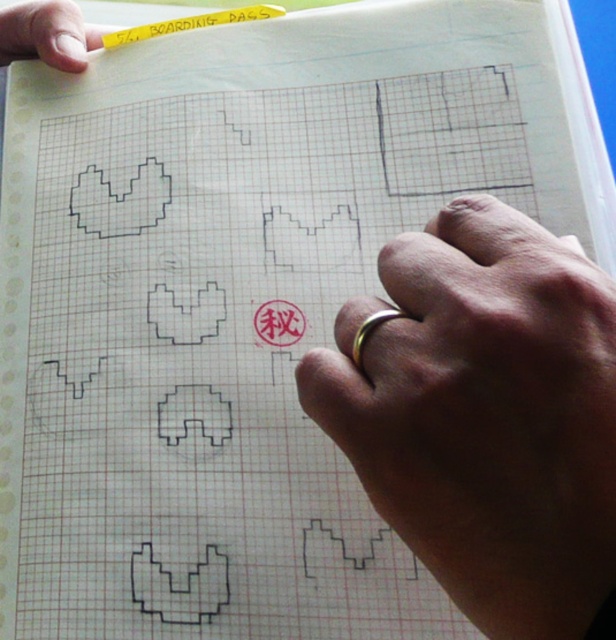
What do you see at coordinates (47, 35) in the screenshot? The width and height of the screenshot is (616, 640). I see `matte white paper at upper left` at bounding box center [47, 35].

Which is in front, point (33, 20) or point (203, 17)?

Positioned in front is point (33, 20).

The height and width of the screenshot is (640, 616). I want to click on matte white paper at upper left, so click(47, 35).

At what (x,y) coordinates should I click in order to perform the action: click on gold ring at center. Please return your answer as a coordinate pair (x, y). This screenshot has height=640, width=616. Looking at the image, I should click on coord(485,416).

Between point (567, 262) and point (107, 48), which one is positioned behind?

Positioned behind is point (107, 48).

The image size is (616, 640). Identify the location of gold ring at center. (485, 416).

Consider the image. Can you confirm if gold ring at center is wider than matte white paper at upper left?

Correct, the width of gold ring at center exceeds that of matte white paper at upper left.

Who is positioned more to the left, gold ring at center or matte white paper at upper left?

From the viewer's perspective, matte white paper at upper left appears more on the left side.

Find the location of a particular element. The image size is (616, 640). gold ring at center is located at coordinates (485, 416).